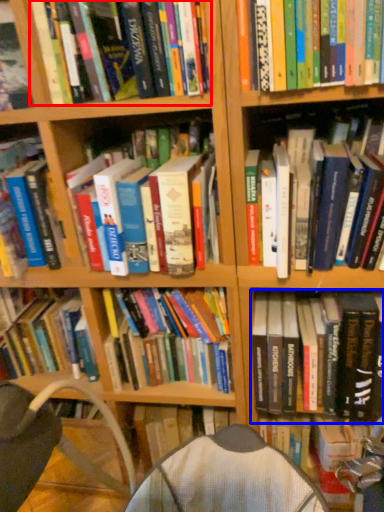
Question: Which object appears closest to the camera in this image, book (highlighted by a red box) or book (highlighted by a blue box)?

Choices:
 (A) book
 (B) book

Answer: (A)